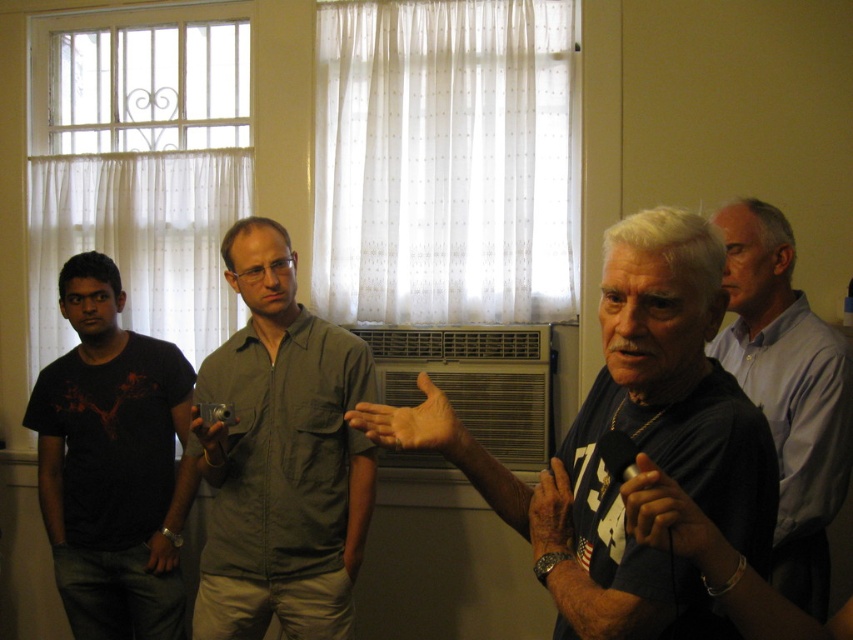
Between matte black hand at center and dry skin hand at center, which one appears on the left side from the viewer's perspective?

From the viewer's perspective, dry skin hand at center appears more on the left side.

Measure the distance between point (641, 488) and camera.

They are 37.77 inches apart.

Between point (643, 540) and point (563, 554), which one is positioned behind?

Positioned behind is point (563, 554).

The width and height of the screenshot is (853, 640). I want to click on matte black hand at center, so click(x=666, y=515).

Can you confirm if light blue shirt at right is wider than dry skin hand at center?

Indeed, light blue shirt at right has a greater width compared to dry skin hand at center.

What do you see at coordinates (788, 392) in the screenshot? The image size is (853, 640). I see `light blue shirt at right` at bounding box center [788, 392].

Is point (817, 352) closer to camera compared to point (543, 500)?

No, (817, 352) is further to viewer.

The height and width of the screenshot is (640, 853). I want to click on light blue shirt at right, so (788, 392).

Does dark blue t-shirt at center have a greater height compared to gray cotton shirt at center?

Incorrect, dark blue t-shirt at center's height is not larger of gray cotton shirt at center's.

Can you confirm if dark blue t-shirt at center is positioned to the left of gray cotton shirt at center?

Incorrect, dark blue t-shirt at center is not on the left side of gray cotton shirt at center.

Measure the distance between dark blue t-shirt at center and camera.

37.03 inches

I want to click on dark blue t-shirt at center, so click(x=659, y=433).